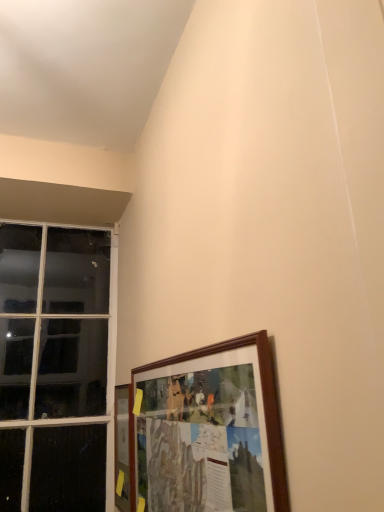
Describe the element at coordinates (54, 368) in the screenshot. I see `clear glass window at left` at that location.

The width and height of the screenshot is (384, 512). What do you see at coordinates (124, 448) in the screenshot?
I see `wooden picture frame at lower left, which is the second picture frame from front to back` at bounding box center [124, 448].

Where is `wooden picture frame at lower left, which is the second picture frame from front to back`? This screenshot has width=384, height=512. wooden picture frame at lower left, which is the second picture frame from front to back is located at coordinates (124, 448).

Image resolution: width=384 pixels, height=512 pixels. In order to click on clear glass window at left in this screenshot , I will do [x=54, y=368].

The image size is (384, 512). I want to click on picture frame that is the 1st one when counting forward from the clear glass window at left, so click(124, 448).

Is wooden picture frame at lower left, which is the second picture frame from front to back, positioned with its back to clear glass window at left?

wooden picture frame at lower left, which is the second picture frame from front to back, does not have its back to clear glass window at left.

Which of these two, wooden picture frame at lower left, which is the first picture frame in left-to-right order, or clear glass window at left, is bigger?

Bigger between the two is clear glass window at left.

Is wooden picture frame at lower left, which is the first picture frame in back-to-front order, positioned far away from clear glass window at left?

Actually, wooden picture frame at lower left, which is the first picture frame in back-to-front order, and clear glass window at left are a little close together.

Between wooden picture frame at lower left, which is counted as the second picture frame, starting from the right, and wooden frame at lower right, which is counted as the 2th picture frame, starting from the back, which one appears on the left side from the viewer's perspective?

From the viewer's perspective, wooden picture frame at lower left, which is counted as the second picture frame, starting from the right, appears more on the left side.

Which object is more forward, wooden picture frame at lower left, which is the first picture frame in back-to-front order, or wooden frame at lower right, which is counted as the 2th picture frame, starting from the back?

wooden frame at lower right, which is counted as the 2th picture frame, starting from the back, is more forward.

Locate an element on the screen. The height and width of the screenshot is (512, 384). picture frame that appears above the wooden picture frame at lower left, which is the second picture frame from front to back (from the image's perspective) is located at coordinates (210, 431).

Does wooden picture frame at lower left, which is counted as the second picture frame, starting from the right, have a lesser height compared to wooden frame at lower right, positioned as the 1th picture frame in front-to-back order?

Yes.

Are wooden frame at lower right, positioned as the 1th picture frame in front-to-back order, and clear glass window at left far apart?

That's right, there is a large distance between wooden frame at lower right, positioned as the 1th picture frame in front-to-back order, and clear glass window at left.

Who is bigger, wooden frame at lower right, marked as the 2th picture frame in a left-to-right arrangement, or clear glass window at left?

clear glass window at left is bigger.

From a real-world perspective, is wooden frame at lower right, which is counted as the 2th picture frame, starting from the back, over clear glass window at left?

No, from a real-world perspective, wooden frame at lower right, which is counted as the 2th picture frame, starting from the back, is not on top of clear glass window at left.

Is clear glass window at left wider than wooden frame at lower right, marked as the 2th picture frame in a left-to-right arrangement?

Yes.

From the image's perspective, is clear glass window at left located above or below wooden frame at lower right, marked as the 2th picture frame in a left-to-right arrangement?

clear glass window at left is situated higher than wooden frame at lower right, marked as the 2th picture frame in a left-to-right arrangement, in the image.

Is point (85, 480) closer to viewer compared to point (184, 494)?

No, it is behind (184, 494).

Visually, is clear glass window at left positioned to the left or to the right of wooden frame at lower right, positioned as the 1th picture frame in front-to-back order?

clear glass window at left is to the left of wooden frame at lower right, positioned as the 1th picture frame in front-to-back order.

Between wooden frame at lower right, positioned as the 1th picture frame in front-to-back order, and wooden picture frame at lower left, which is the second picture frame from front to back, which one has smaller size?

wooden picture frame at lower left, which is the second picture frame from front to back, is smaller.

Which is in front, point (175, 418) or point (123, 398)?

The point (175, 418) is in front.

Is wooden picture frame at lower left, which is the second picture frame from front to back, at the back of wooden frame at lower right, marked as the 2th picture frame in a left-to-right arrangement?

wooden frame at lower right, marked as the 2th picture frame in a left-to-right arrangement, is not turned away from wooden picture frame at lower left, which is the second picture frame from front to back.

Who is more distant, wooden frame at lower right, the 1th picture frame viewed from the right, or wooden picture frame at lower left, which is the second picture frame from front to back?

wooden picture frame at lower left, which is the second picture frame from front to back, is behind.

Which object is closer to the camera taking this photo, clear glass window at left or wooden picture frame at lower left, which is counted as the second picture frame, starting from the right?

Positioned in front is wooden picture frame at lower left, which is counted as the second picture frame, starting from the right.

Is clear glass window at left inside the boundaries of wooden picture frame at lower left, which is the first picture frame in back-to-front order, or outside?

clear glass window at left lies outside wooden picture frame at lower left, which is the first picture frame in back-to-front order.

Is point (46, 246) farther from viewer compared to point (126, 401)?

That is True.

Identify the location of picture frame that is the 2nd object located below the clear glass window at left (from the image's perspective). (124, 448).

Find the location of a particular element. The width and height of the screenshot is (384, 512). picture frame to the right of wooden picture frame at lower left, which is counted as the second picture frame, starting from the right is located at coordinates (210, 431).

When comparing their distances from wooden picture frame at lower left, which is the first picture frame in left-to-right order, does wooden frame at lower right, which is counted as the 2th picture frame, starting from the back, or clear glass window at left seem further?

Among the two, clear glass window at left is located further to wooden picture frame at lower left, which is the first picture frame in left-to-right order.

From the picture: Based on their spatial positions, is wooden picture frame at lower left, which is the first picture frame in back-to-front order, or clear glass window at left closer to wooden frame at lower right, positioned as the 1th picture frame in front-to-back order?

Among the two, wooden picture frame at lower left, which is the first picture frame in back-to-front order, is located nearer to wooden frame at lower right, positioned as the 1th picture frame in front-to-back order.

From the image, which object appears to be farther from clear glass window at left, wooden frame at lower right, positioned as the 1th picture frame in front-to-back order, or wooden picture frame at lower left, which is the first picture frame in back-to-front order?

wooden frame at lower right, positioned as the 1th picture frame in front-to-back order.

Looking at the image, which one is located closer to wooden frame at lower right, the 1th picture frame viewed from the right, clear glass window at left or wooden picture frame at lower left, which is the second picture frame from front to back?

wooden picture frame at lower left, which is the second picture frame from front to back.

From the image, which object appears to be nearer to clear glass window at left, wooden picture frame at lower left, which is the second picture frame from front to back, or wooden frame at lower right, positioned as the 1th picture frame in front-to-back order?

Based on the image, wooden picture frame at lower left, which is the second picture frame from front to back, appears to be nearer to clear glass window at left.

Considering their positions, is clear glass window at left positioned further to wooden picture frame at lower left, which is the second picture frame from front to back, than wooden frame at lower right, marked as the 2th picture frame in a left-to-right arrangement?

Based on the image, clear glass window at left appears to be further to wooden picture frame at lower left, which is the second picture frame from front to back.

Where is `picture frame located between wooden frame at lower right, the 1th picture frame viewed from the right, and clear glass window at left in the depth direction`? This screenshot has height=512, width=384. picture frame located between wooden frame at lower right, the 1th picture frame viewed from the right, and clear glass window at left in the depth direction is located at coordinates pyautogui.click(x=124, y=448).